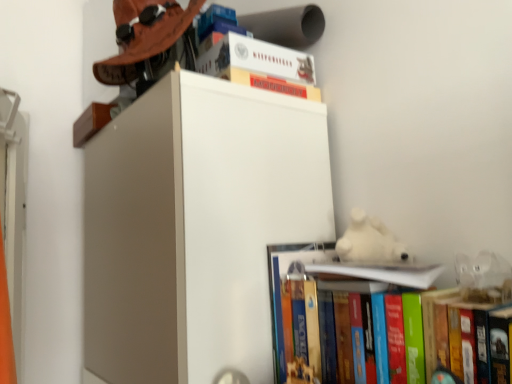
Question: Relative to matte brown hat at upper left, is white paper at upper center, marked as the second book in a bottom-to-top arrangement, in front or behind?

Choices:
 (A) front
 (B) behind

Answer: (A)

Question: Considering the positions of white paper at upper center, marked as the second book in a bottom-to-top arrangement, and matte brown hat at upper left in the image, is white paper at upper center, marked as the second book in a bottom-to-top arrangement, taller or shorter than matte brown hat at upper left?

Choices:
 (A) short
 (B) tall

Answer: (A)

Question: Which object is positioned closest to the white paper at upper center, marked as the second book in a bottom-to-top arrangement?

Choices:
 (A) hardcover book at lower right, which is counted as the third book, starting from the top
 (B) white plush bear at upper right
 (C) hardcover book at upper center, the 1th book in the top-to-bottom sequence
 (D) matte brown hat at upper left

Answer: (A)

Question: Considering the real-world distances, which object is closest to the hardcover book at upper center, arranged as the third book when ordered from the bottom?

Choices:
 (A) matte brown hat at upper left
 (B) hardcover book at lower right, acting as the first book starting from the bottom
 (C) white paper at upper center, marked as the second book in a bottom-to-top arrangement
 (D) white plush bear at upper right

Answer: (A)